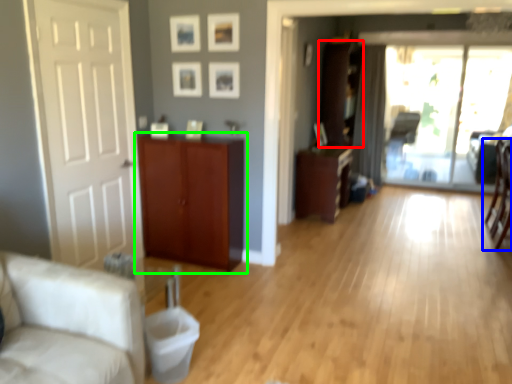
Question: Estimate the real-world distances between objects in this image. Which object is farther from cabinetry (highlighted by a red box), chair (highlighted by a blue box) or cabinetry (highlighted by a green box)?

Choices:
 (A) chair
 (B) cabinetry

Answer: (B)